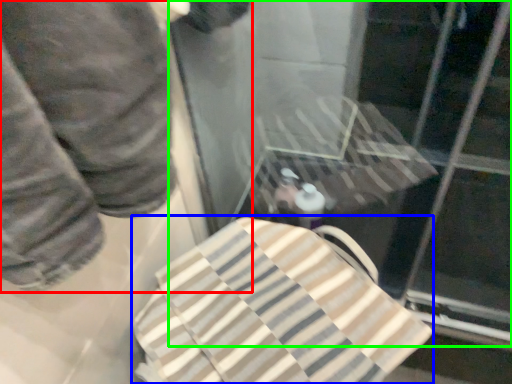
Question: Which is nearer to the person (highlighted by a red box)? beach towel (highlighted by a blue box) or glass door (highlighted by a green box).

Choices:
 (A) beach towel
 (B) glass door

Answer: (A)